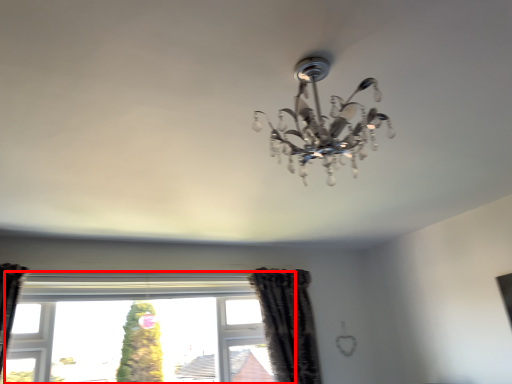
Question: From the image's perspective, what is the correct spatial relationship of window (annotated by the red box) in relation to curtain?

Choices:
 (A) above
 (B) below

Answer: (B)